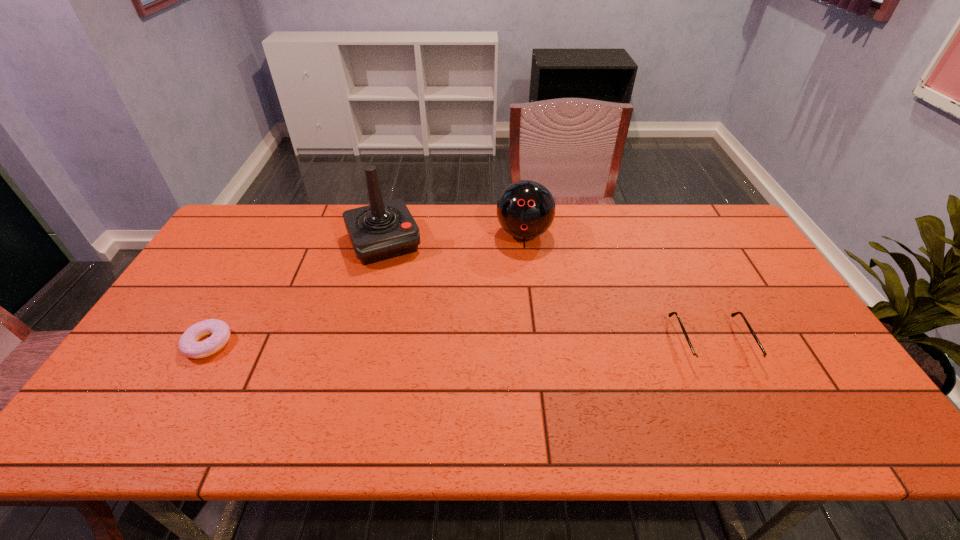
You are a GUI agent. You are given a task and a screenshot of the screen. Output one action in this format:
    pyautogui.click(x=<x>, y=<y>)
    Task: Click on the shortest object
    This screenshot has width=960, height=540.
    Given the screenshot: What is the action you would take?
    pyautogui.click(x=219, y=330)

The width and height of the screenshot is (960, 540). I want to click on the leftmost object, so click(219, 330).

This screenshot has width=960, height=540. What are the coordinates of `spectacles` in the screenshot? It's located at (704, 361).

Find the location of a particular element. The image size is (960, 540). the third tallest object is located at coordinates (704, 361).

The width and height of the screenshot is (960, 540). Find the location of `the tallest object`. the tallest object is located at coordinates [x=382, y=230].

This screenshot has width=960, height=540. Identify the location of joystick. (382, 230).

Locate an element on the screen. bowling ball is located at coordinates (526, 209).

Find the location of a particular element. the third shortest object is located at coordinates (526, 209).

I want to click on blank space located 0.080m on the back of the shortest object, so click(x=230, y=305).

Where is `vacant space situated at the hinge ends of the spectacles`? vacant space situated at the hinge ends of the spectacles is located at coordinates (739, 401).